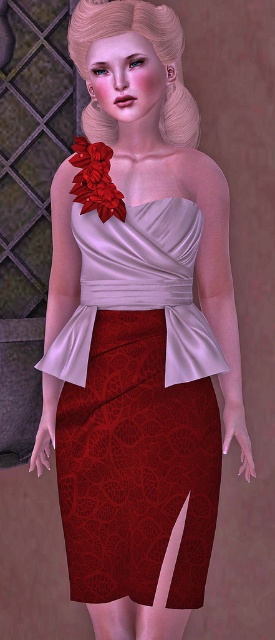
Is velvet red skirt at center positioned behind shiny red fabric flower at upper center?

No.

Does velvet red skirt at center come in front of shiny red fabric flower at upper center?

Yes, it is in front of shiny red fabric flower at upper center.

Where is `velvet red skirt at center`? The width and height of the screenshot is (275, 640). velvet red skirt at center is located at coordinates (136, 467).

Image resolution: width=275 pixels, height=640 pixels. Find the location of `velvet red skirt at center`. velvet red skirt at center is located at coordinates (136, 467).